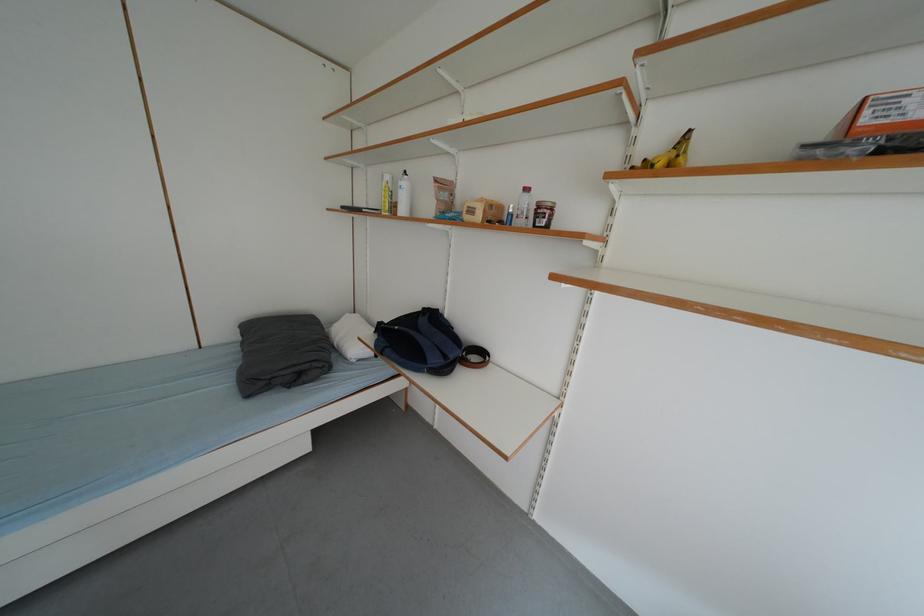
Find the location of a particular element. This screenshot has height=616, width=924. red bottle cap is located at coordinates (524, 187).